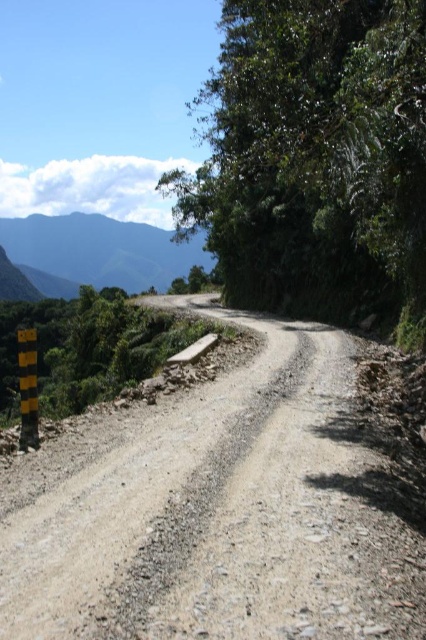
Which is above, gray gravel road at center or green leafy tree at upper right?

green leafy tree at upper right is higher up.

Which is more to the left, gray gravel road at center or green leafy tree at upper right?

Positioned to the left is green leafy tree at upper right.

Is point (342, 579) farther from camera compared to point (408, 323)?

That is False.

At what (x,y) coordinates should I click in order to perform the action: click on gray gravel road at center. Please return your answer as a coordinate pair (x, y). The image size is (426, 640). Looking at the image, I should click on (218, 509).

Does green leafy tree at upper right have a greater height compared to green textured mountain at upper left?

Correct, green leafy tree at upper right is much taller as green textured mountain at upper left.

Can you confirm if green leafy tree at upper right is positioned to the left of green textured mountain at upper left?

In fact, green leafy tree at upper right is to the right of green textured mountain at upper left.

The width and height of the screenshot is (426, 640). Describe the element at coordinates (314, 156) in the screenshot. I see `green leafy tree at upper right` at that location.

Where is `green leafy tree at upper right`? The height and width of the screenshot is (640, 426). green leafy tree at upper right is located at coordinates click(314, 156).

Does point (83, 540) come farther from viewer compared to point (201, 237)?

No.

Does gray gravel road at center lie behind green textured mountain at upper left?

That is False.

Which is in front, point (288, 435) or point (89, 276)?

Point (288, 435) is more forward.

What are the coordinates of `gray gravel road at center` in the screenshot? It's located at (218, 509).